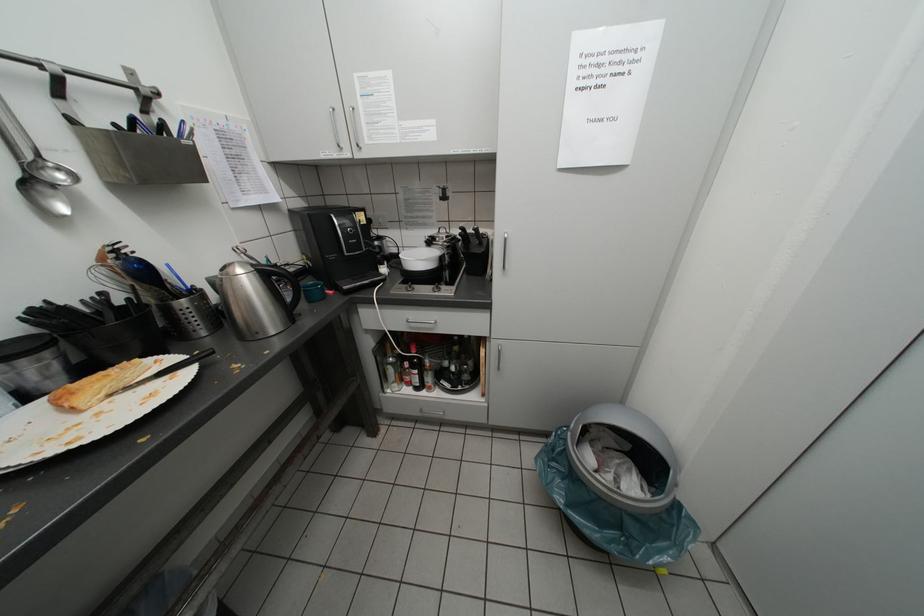
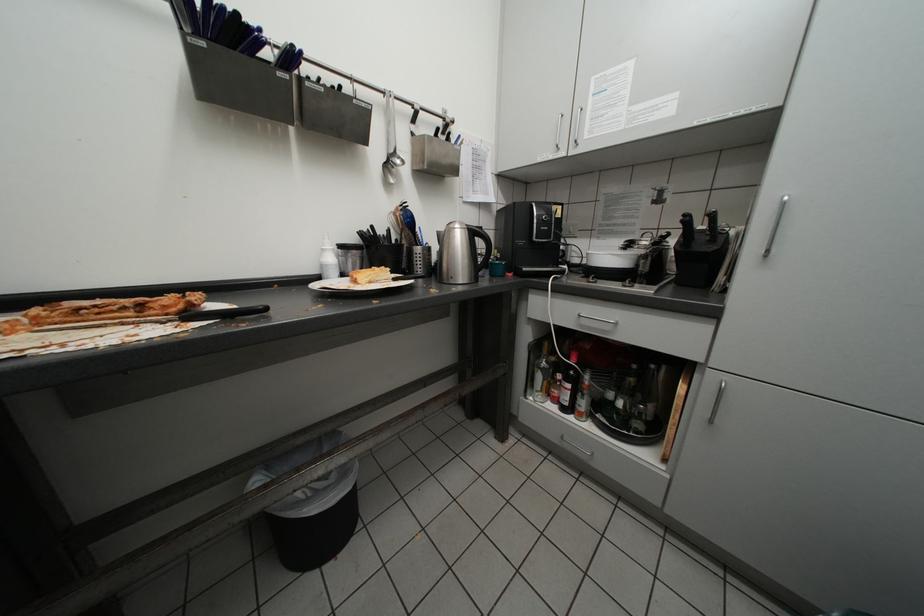
Question: The camera is either moving clockwise (left) or counter-clockwise (right) around the object. The first image is from the beginning of the video and the second image is from the end. Is the camera moving left or right when shooting the video?

Choices:
 (A) Left
 (B) Right

Answer: (B)